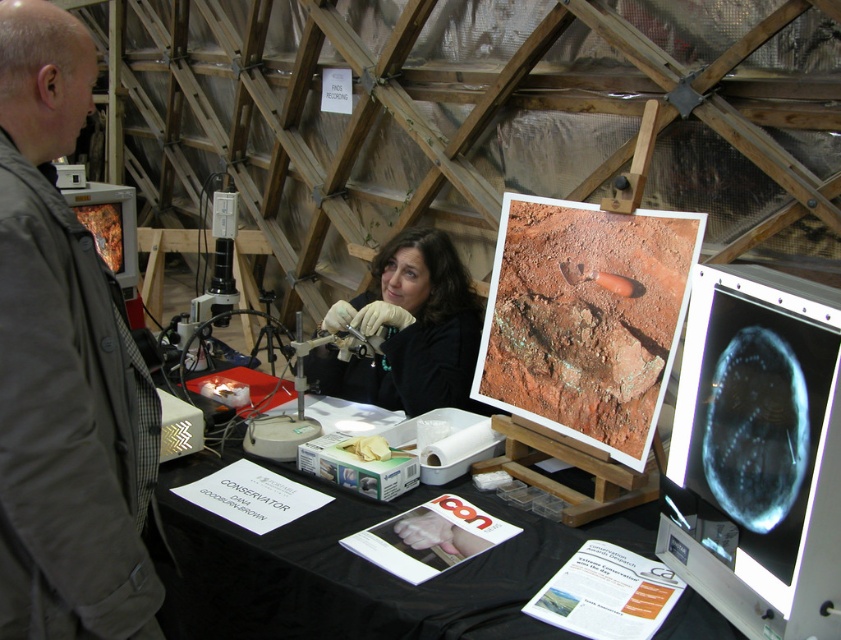
Can you confirm if blue glossy monitor at upper right is smaller than black paper table at center?

Indeed, blue glossy monitor at upper right has a smaller size compared to black paper table at center.

Who is positioned more to the right, blue glossy monitor at upper right or black paper table at center?

From the viewer's perspective, blue glossy monitor at upper right appears more on the right side.

Between point (722, 348) and point (506, 576), which one is positioned behind?

Point (506, 576)

You are a GUI agent. You are given a task and a screenshot of the screen. Output one action in this format:
    pyautogui.click(x=<x>, y=<y>)
    Task: Click on the blue glossy monitor at upper right
    This screenshot has height=640, width=841.
    Given the screenshot: What is the action you would take?
    pyautogui.click(x=758, y=452)

Is gray fabric jacket at left bigger than black paper table at center?

Incorrect, gray fabric jacket at left is not larger than black paper table at center.

Between gray fabric jacket at left and black paper table at center, which one has less height?

black paper table at center

Between point (94, 598) and point (353, 572), which one is positioned behind?

The point (353, 572) is more distant.

This screenshot has width=841, height=640. In order to click on gray fabric jacket at left in this screenshot , I will do `click(61, 364)`.

Measure the distance between black paper table at center and metallic orange computer monitor at left.

They are 1.16 meters apart.

Can you confirm if black paper table at center is taller than metallic orange computer monitor at left?

No.

Is point (374, 588) positioned after point (131, 202)?

No, (374, 588) is in front of (131, 202).

Image resolution: width=841 pixels, height=640 pixels. Find the location of `black paper table at center`. black paper table at center is located at coordinates (355, 568).